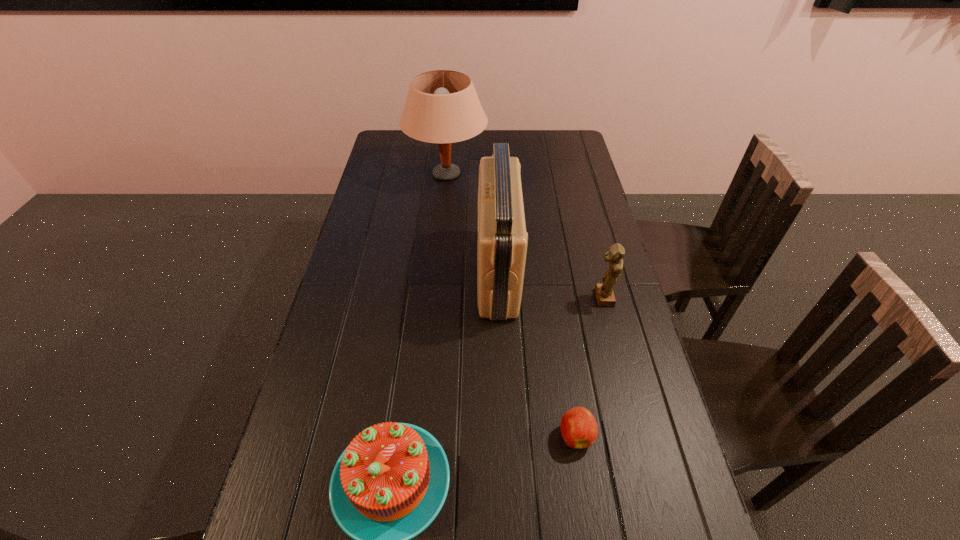
Where is `radio receiver`? radio receiver is located at coordinates (502, 243).

The width and height of the screenshot is (960, 540). I want to click on the farthest object, so 442,106.

You are a GUI agent. You are given a task and a screenshot of the screen. Output one action in this format:
    pyautogui.click(x=<x>, y=<y>)
    Task: Click on the rightmost object
    This screenshot has width=960, height=540.
    Given the screenshot: What is the action you would take?
    pyautogui.click(x=604, y=292)

The width and height of the screenshot is (960, 540). What are the coordinates of `the third shortest object` in the screenshot? It's located at (604, 292).

Identify the location of the fourth object from left to right. The height and width of the screenshot is (540, 960). (579, 429).

Identify the location of the shortest object. (579, 429).

The image size is (960, 540). Find the location of `free space located 0.380m on the front-facing side of the radio receiver`. free space located 0.380m on the front-facing side of the radio receiver is located at coordinates (357, 273).

Locate an element on the screen. free space located on the front-facing side of the radio receiver is located at coordinates (443, 273).

Image resolution: width=960 pixels, height=540 pixels. What are the coordinates of `free space located on the front-facing side of the radio receiver` in the screenshot? It's located at (370, 273).

Image resolution: width=960 pixels, height=540 pixels. I want to click on free point located on the front-facing side of the farthest object, so click(x=582, y=174).